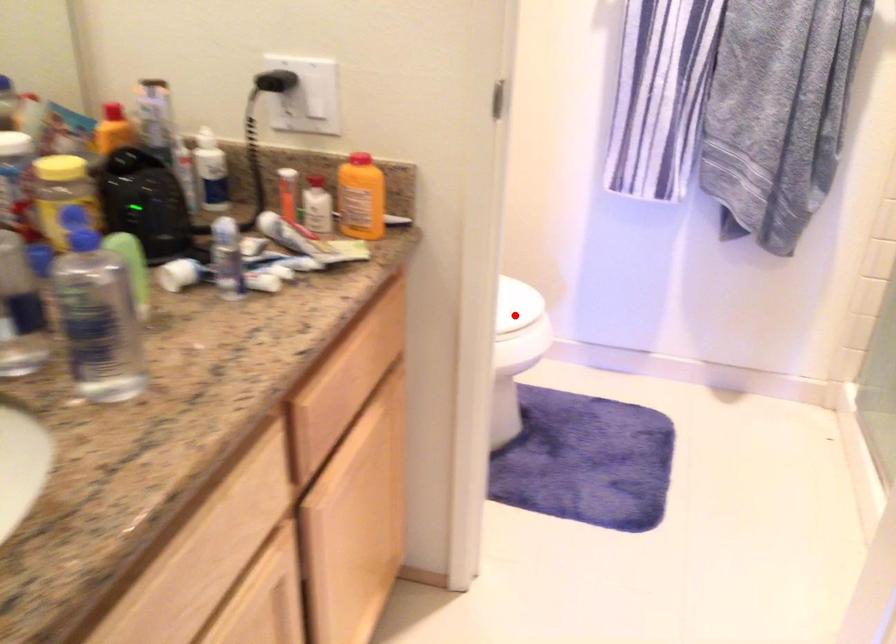
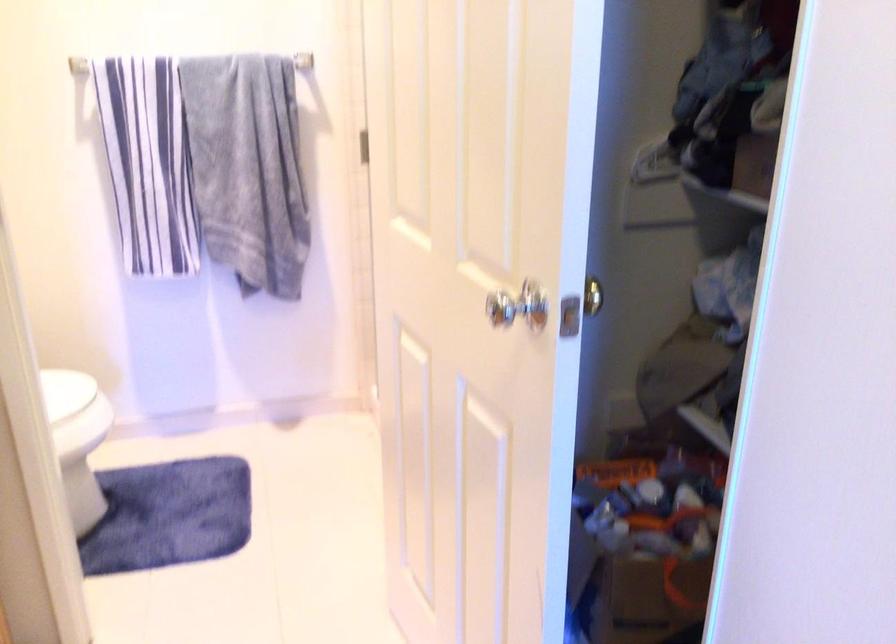
Question: I am providing you with two images of the same scene from different viewpoints. Given a red point in image1, look at the same physical point in image2. Is it:

Choices:
 (A) Closer to the viewpoint
 (B) Farther from the viewpoint

Answer: (B)